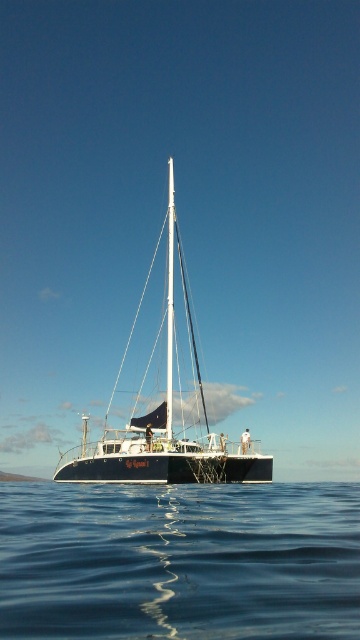
Who is shorter, blue liquid water at lower center or white glossy mast at center?

Standing shorter between the two is blue liquid water at lower center.

Does blue liquid water at lower center appear on the left side of white glossy mast at center?

In fact, blue liquid water at lower center is to the right of white glossy mast at center.

The height and width of the screenshot is (640, 360). What do you see at coordinates (178, 561) in the screenshot? I see `blue liquid water at lower center` at bounding box center [178, 561].

The width and height of the screenshot is (360, 640). Identify the location of blue liquid water at lower center. (178, 561).

Which is in front, point (174, 442) or point (167, 396)?

Point (174, 442)

Is white glossy sailboat at center to the left of white glossy mast at center from the viewer's perspective?

Indeed, white glossy sailboat at center is positioned on the left side of white glossy mast at center.

Does point (241, 452) lie in front of point (169, 248)?

Yes, point (241, 452) is in front of point (169, 248).

Identify the location of white glossy sailboat at center. (163, 449).

Does blue liquid water at lower center have a lesser width compared to white glossy sailboat at center?

Incorrect, blue liquid water at lower center's width is not less than white glossy sailboat at center's.

Between blue liquid water at lower center and white glossy sailboat at center, which one appears on the right side from the viewer's perspective?

From the viewer's perspective, blue liquid water at lower center appears more on the right side.

In order to click on blue liquid water at lower center in this screenshot , I will do `click(178, 561)`.

Locate an element on the screen. blue liquid water at lower center is located at coordinates (178, 561).